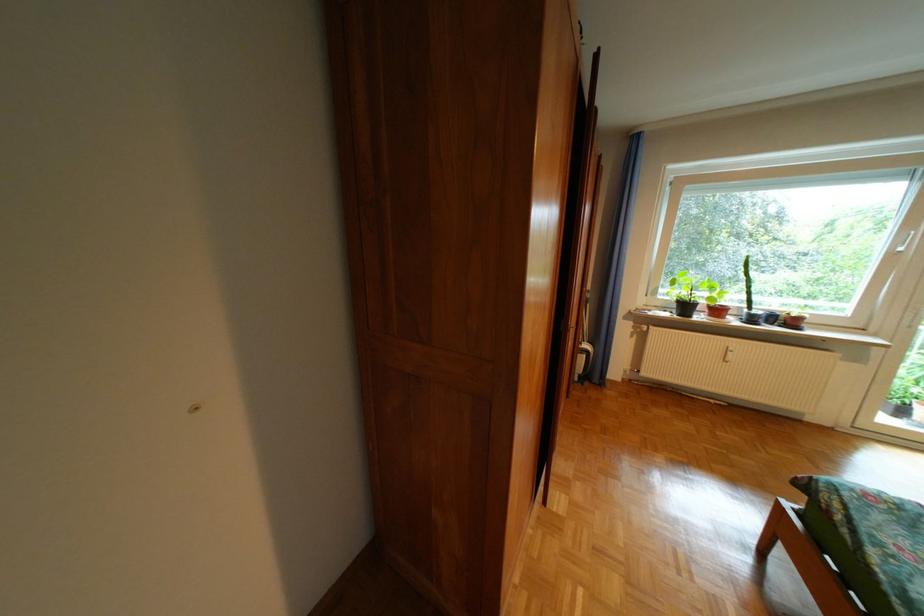
Identify the location of white window handle. The height and width of the screenshot is (616, 924). (908, 238).